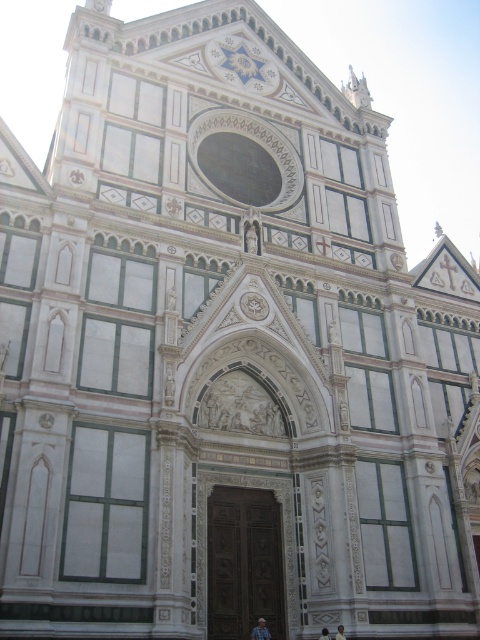
You are standing in front of the grand Renaissance building and notice the light blue denim jeans at lower center. Based on their position, can you determine if they are closer to the central arched doorway or the triangular pediment above it?

The light blue denim jeans at lower center is located at point (261, 630), which places it closer to the central arched doorway than the triangular pediment above it.

You are standing in front of the grand building and want to enter through the light brown wooden door at center. There is a light brown leather jacket at lower center in your way. Can you walk around the jacket to reach the door?

The light brown leather jacket at lower center is shorter than the light brown wooden door at center, so you can step over it to reach the door.

You are standing in front of the grand building and notice two items at the base of the structure. You see the light blue denim jeans at lower center and the light brown wooden door at center. Which object is positioned to the left when viewed from your perspective?

The light blue denim jeans at lower center are to the left of the light brown wooden door at center.